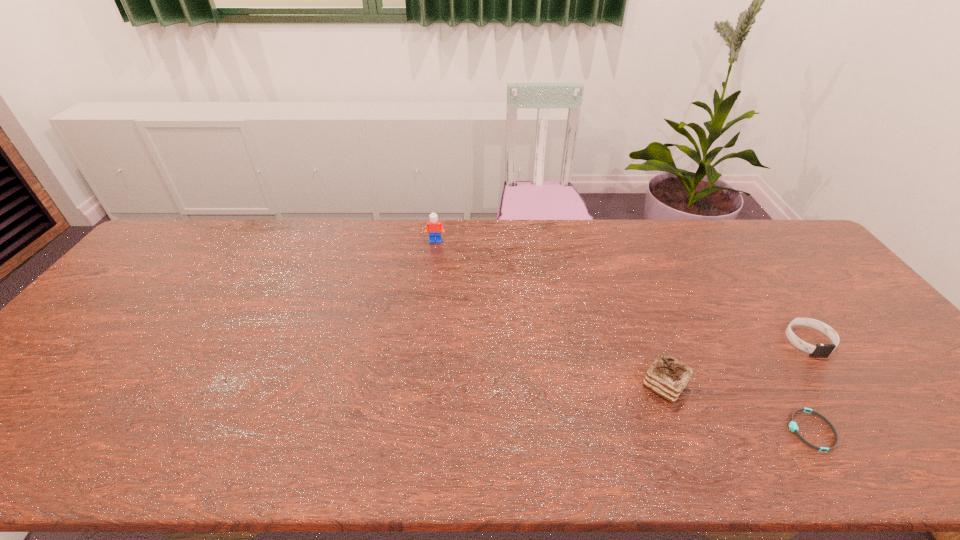
Find the location of a particular element. The image size is (960, 540). vacant space positioned on the outer surface of the second farthest object is located at coordinates (837, 380).

Find the location of a particular element. This screenshot has height=540, width=960. vacant space located 0.260m on the buckle of the nearer wristband is located at coordinates (671, 430).

Where is `vacant space located on the buckle of the nearer wristband`? Image resolution: width=960 pixels, height=540 pixels. vacant space located on the buckle of the nearer wristband is located at coordinates (708, 430).

Locate an element on the screen. This screenshot has width=960, height=540. free space located on the buckle of the nearer wristband is located at coordinates pos(621,430).

The width and height of the screenshot is (960, 540). What are the coordinates of `object that is positioned at the far edge` in the screenshot? It's located at (435, 227).

Where is `object located in the near edge section of the desktop`? The height and width of the screenshot is (540, 960). object located in the near edge section of the desktop is located at coordinates (793, 426).

The width and height of the screenshot is (960, 540). I want to click on object situated at the right edge, so click(820, 350).

I want to click on vacant space at the far edge of the desktop, so click(x=731, y=261).

At what (x,y) coordinates should I click in order to perform the action: click on vacant space at the near edge of the desktop. Please return your answer as a coordinate pair (x, y). Looking at the image, I should click on (516, 430).

Image resolution: width=960 pixels, height=540 pixels. In the image, there is a desktop. Find the location of `blank space at the left edge`. blank space at the left edge is located at coordinates (166, 278).